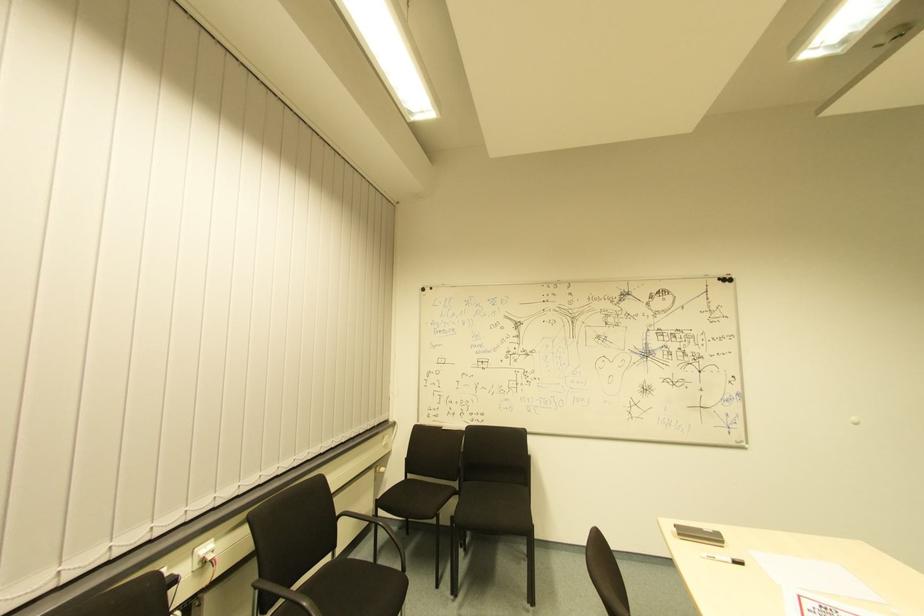
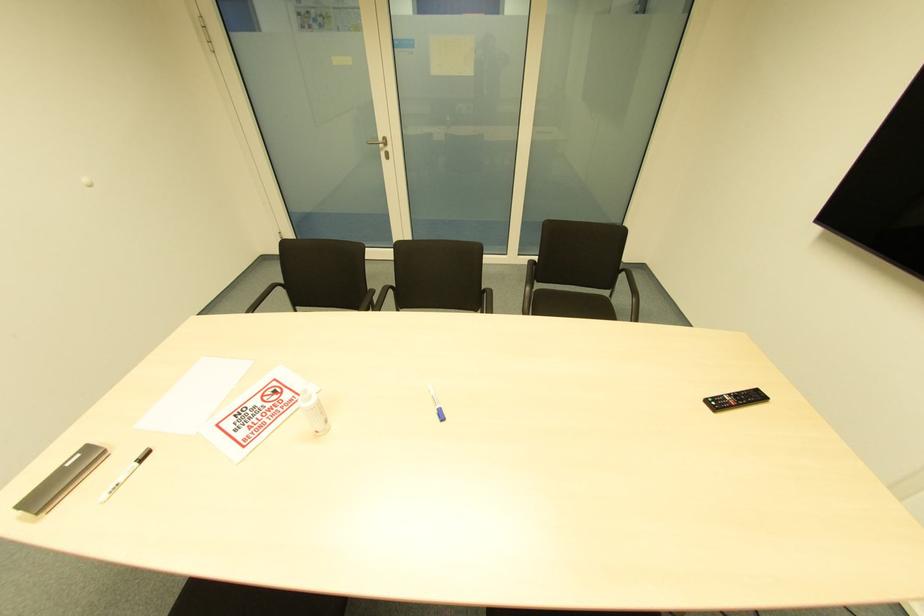
The first image is from the beginning of the video and the second image is from the end. How did the camera likely rotate when shooting the video?

The camera's rotation is toward right-down.